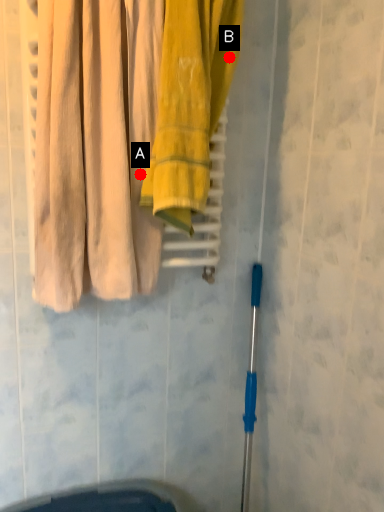
Question: Two points are circled on the image, labeled by A and B beside each circle. Which point is closer to the camera?

Choices:
 (A) A is closer
 (B) B is closer

Answer: (A)